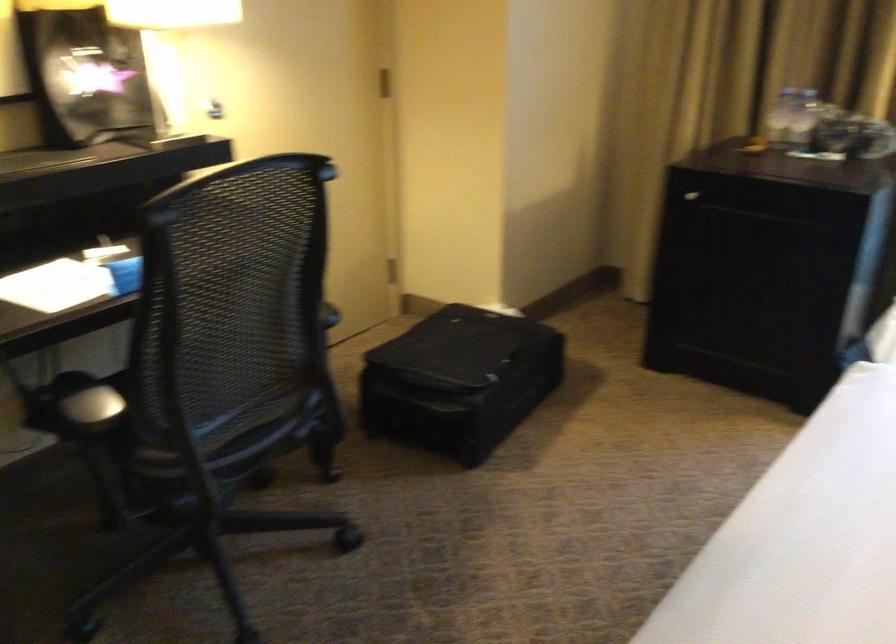
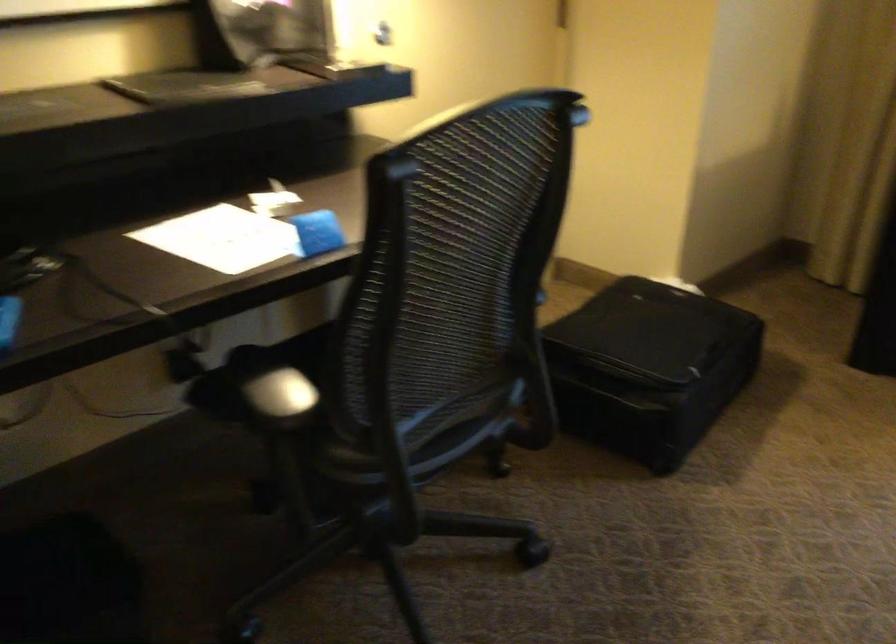
In the second image, find the point that corresponds to pixel 453 379 in the first image.

(649, 366)